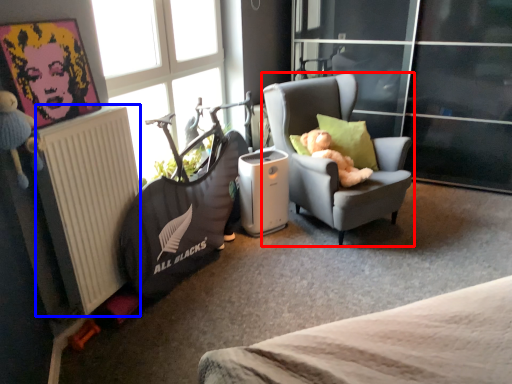
Question: Which point is closer to the camera, chair (highlighted by a red box) or radiator (highlighted by a blue box)?

Choices:
 (A) chair
 (B) radiator

Answer: (B)